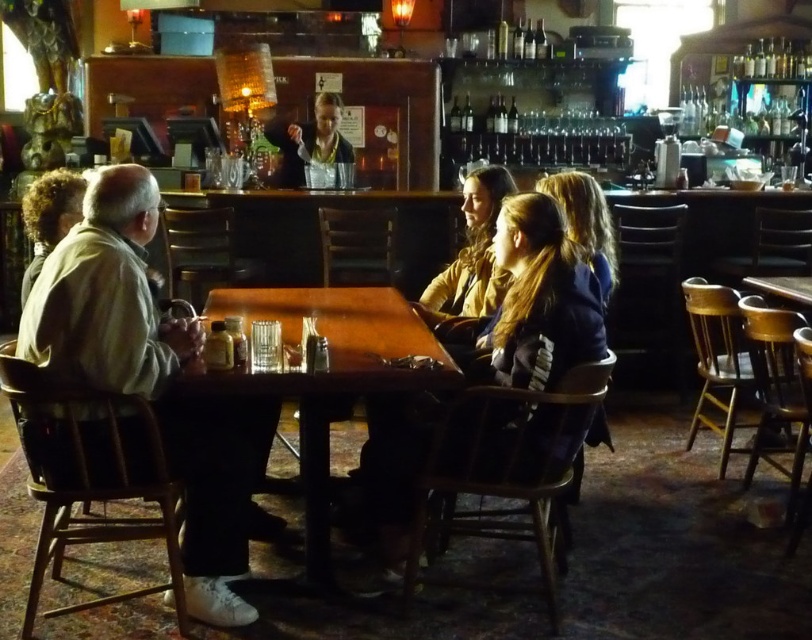
Looking at this image, which is below, curly hair at left or clear glass bottles at upper right?

curly hair at left

Between curly hair at left and clear glass bottles at upper right, which one appears on the right side from the viewer's perspective?

clear glass bottles at upper right

Which is behind, point (54, 208) or point (752, 42)?

Point (752, 42)

This screenshot has height=640, width=812. Find the location of `curly hair at left`. curly hair at left is located at coordinates pyautogui.click(x=50, y=216).

Does dark brown leather jacket at center have a larger size compared to curly hair at left?

Yes.

Which is more to the left, dark brown leather jacket at center or curly hair at left?

curly hair at left is more to the left.

Between point (568, 438) and point (44, 244), which one is positioned in front?

Point (568, 438)

In order to click on dark brown leather jacket at center in this screenshot , I will do `click(532, 304)`.

What do you see at coordinates (532, 304) in the screenshot? I see `dark brown leather jacket at center` at bounding box center [532, 304].

Does dark brown leather jacket at center have a lesser width compared to wooden table at center?

Correct, dark brown leather jacket at center's width is less than wooden table at center's.

This screenshot has height=640, width=812. I want to click on dark brown leather jacket at center, so click(x=532, y=304).